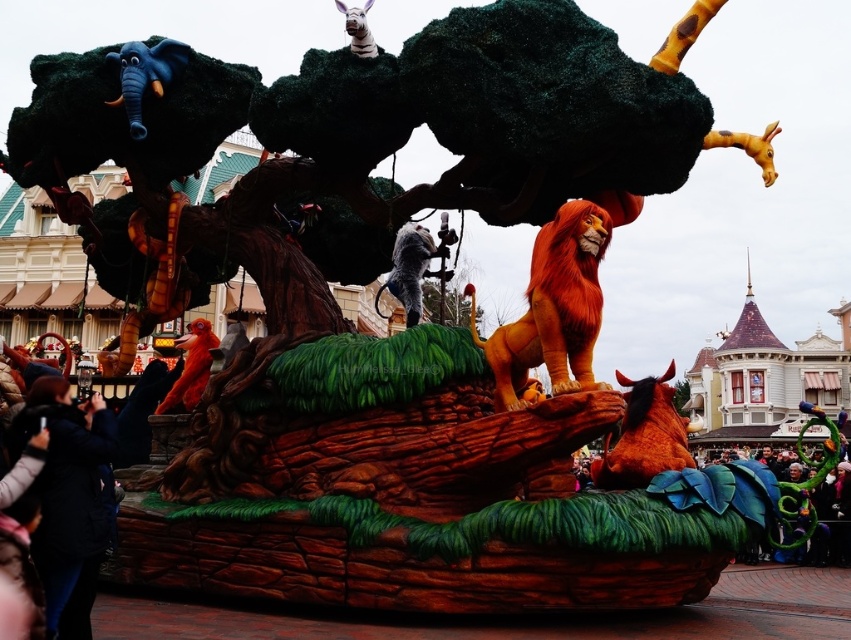
Question: Which point is farther from the camera taking this photo?

Choices:
 (A) (349, 42)
 (B) (189, 346)
 (C) (53, 472)
 (D) (543, 339)

Answer: (B)

Question: Estimate the real-world distances between objects in this image. Which object is closer to the velvet red lion at center?

Choices:
 (A) white matte zebra at upper center
 (B) matte blue elephant at upper left

Answer: (B)

Question: Considering the relative positions of shiny orange horse at center and shiny silver monkey at center in the image provided, where is shiny orange horse at center located with respect to shiny silver monkey at center?

Choices:
 (A) left
 (B) right

Answer: (B)

Question: Can you confirm if orange plush lion at center is positioned above shiny silver monkey at center?

Choices:
 (A) yes
 (B) no

Answer: (B)

Question: Does shiny silver monkey at center appear on the left side of white matte zebra at upper center?

Choices:
 (A) yes
 (B) no

Answer: (B)

Question: Which of the following is the closest to the observer?

Choices:
 (A) (176, 387)
 (B) (163, 74)

Answer: (B)